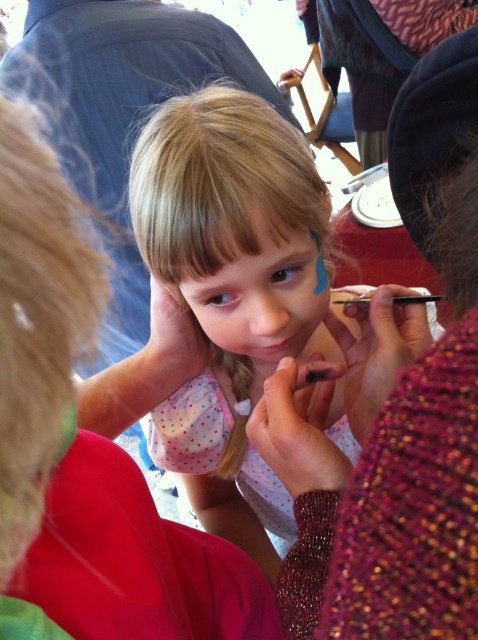
Who is more distant from viewer, (x=37, y=12) or (x=265, y=344)?

The point (x=37, y=12) is behind.

Consider the image. Does smooth skin tone hand at center have a lesser height compared to smooth skin face at center?

In fact, smooth skin tone hand at center may be taller than smooth skin face at center.

Find the location of `smooth skin tone hand at center`. smooth skin tone hand at center is located at coordinates (119, 112).

Between pastel polka dot dress at center and smooth skin tone hand at center, which one has more height?

With more height is smooth skin tone hand at center.

Does pastel polka dot dress at center have a smaller size compared to smooth skin tone hand at center?

Yes, pastel polka dot dress at center is smaller than smooth skin tone hand at center.

The image size is (478, 640). In order to click on pastel polka dot dress at center in this screenshot , I will do `click(231, 291)`.

Can you confirm if pastel polka dot dress at center is positioned to the right of smooth skin face at center?

Correct, you'll find pastel polka dot dress at center to the right of smooth skin face at center.

Who is more forward, (219, 492) or (262, 227)?

Point (262, 227)

You are a GUI agent. You are given a task and a screenshot of the screen. Output one action in this format:
    pyautogui.click(x=<x>, y=<y>)
    Task: Click on the pastel polka dot dress at center
    
    Given the screenshot: What is the action you would take?
    pyautogui.click(x=231, y=291)